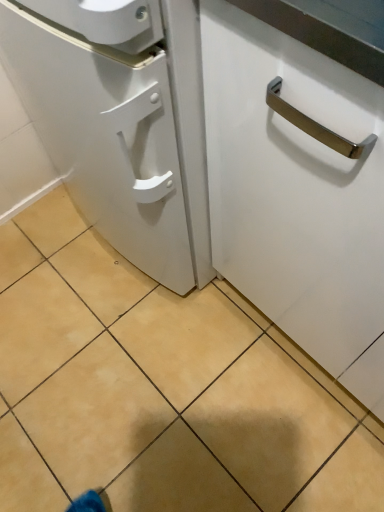
This screenshot has height=512, width=384. I want to click on white glossy cabinet handle at center, so click(297, 194).

The width and height of the screenshot is (384, 512). Describe the element at coordinates (297, 194) in the screenshot. I see `white glossy cabinet handle at center` at that location.

What do you see at coordinates (160, 389) in the screenshot? This screenshot has width=384, height=512. I see `beige tile at center` at bounding box center [160, 389].

In order to face beige tile at center, should I rotate leftwards or rightwards?

To face it directly, rotate left by 9.721 degrees.

Locate an element on the screen. The width and height of the screenshot is (384, 512). beige tile at center is located at coordinates (160, 389).

What is the approximate height of beige tile at center?

beige tile at center is 1.40 inches tall.

I want to click on white glossy cabinet handle at center, so click(297, 194).

From the picture: Considering the relative positions of white glossy cabinet handle at center and beige tile at center in the image provided, is white glossy cabinet handle at center to the left or to the right of beige tile at center?

From the image, it's evident that white glossy cabinet handle at center is to the right of beige tile at center.

Considering their positions, is white glossy cabinet handle at center located in front of or behind beige tile at center?

Visually, white glossy cabinet handle at center is located in front of beige tile at center.

Does point (340, 249) appear closer or farther from the camera than point (91, 417)?

Point (340, 249) is positioned closer to the camera compared to point (91, 417).

From the image's perspective, is white glossy cabinet handle at center positioned above or below beige tile at center?

Clearly, from the image's perspective, white glossy cabinet handle at center is above beige tile at center.

From a real-world perspective, relative to beige tile at center, is white glossy cabinet handle at center vertically above or below?

In terms of real-world spatial position, white glossy cabinet handle at center is above beige tile at center.

Considering the sizes of objects white glossy cabinet handle at center and beige tile at center in the image provided, who is thinner, white glossy cabinet handle at center or beige tile at center?

white glossy cabinet handle at center is thinner.

Considering the sizes of objects white glossy cabinet handle at center and beige tile at center in the image provided, who is taller, white glossy cabinet handle at center or beige tile at center?

white glossy cabinet handle at center is taller.

Considering the relative sizes of white glossy cabinet handle at center and beige tile at center in the image provided, is white glossy cabinet handle at center bigger than beige tile at center?

Indeed, white glossy cabinet handle at center has a larger size compared to beige tile at center.

Is white glossy cabinet handle at center spatially inside beige tile at center, or outside of it?

white glossy cabinet handle at center is not inside beige tile at center, it's outside.

Are white glossy cabinet handle at center and beige tile at center far apart?

Actually, white glossy cabinet handle at center and beige tile at center are a little close together.

Is white glossy cabinet handle at center facing towards beige tile at center?

Yes, white glossy cabinet handle at center faces towards beige tile at center.

Can you tell me how much white glossy cabinet handle at center and beige tile at center differ in facing direction?

The angle between the facing direction of white glossy cabinet handle at center and the facing direction of beige tile at center is 0.153 degrees.

Find the location of a particular element. The image size is (384, 512). tile lying behind the white glossy cabinet handle at center is located at coordinates (160, 389).

Is beige tile at center to the right of white glossy cabinet handle at center from the viewer's perspective?

Incorrect, beige tile at center is not on the right side of white glossy cabinet handle at center.

Which is behind, beige tile at center or white glossy cabinet handle at center?

beige tile at center is further away from the camera.

Between point (172, 426) and point (291, 251), which one is positioned behind?

The point (172, 426) is farther.

From the image's perspective, is beige tile at center under white glossy cabinet handle at center?

Yes, from the image's perspective, beige tile at center is beneath white glossy cabinet handle at center.

From a real-world perspective, who is located higher, beige tile at center or white glossy cabinet handle at center?

white glossy cabinet handle at center is physically above.

Can you confirm if beige tile at center is wider than white glossy cabinet handle at center?

Yes, beige tile at center is wider than white glossy cabinet handle at center.

Can you confirm if beige tile at center is taller than white glossy cabinet handle at center?

In fact, beige tile at center may be shorter than white glossy cabinet handle at center.

Who is bigger, beige tile at center or white glossy cabinet handle at center?

With larger size is white glossy cabinet handle at center.

Would you say beige tile at center is outside white glossy cabinet handle at center?

beige tile at center lies outside white glossy cabinet handle at center's area.

In the scene shown: Would you say beige tile at center is a long distance from white glossy cabinet handle at center?

No, beige tile at center is in close proximity to white glossy cabinet handle at center.

Is beige tile at center positioned with its back to white glossy cabinet handle at center?

No, beige tile at center's orientation is not away from white glossy cabinet handle at center.

How many degrees apart are the facing directions of beige tile at center and white glossy cabinet handle at center?

0.153 degrees separate the facing orientations of beige tile at center and white glossy cabinet handle at center.

You are a GUI agent. You are given a task and a screenshot of the screen. Output one action in this format:
    pyautogui.click(x=<x>, y=<y>)
    Task: Click on the tile behind the white glossy cabinet handle at center
    
    Given the screenshot: What is the action you would take?
    pyautogui.click(x=160, y=389)

This screenshot has height=512, width=384. Find the location of `tile located underneath the white glossy cabinet handle at center (from a real-world perspective)`. tile located underneath the white glossy cabinet handle at center (from a real-world perspective) is located at coordinates pyautogui.click(x=160, y=389).

Where is `cabinetry positioned vertically above the beige tile at center (from a real-world perspective)`? cabinetry positioned vertically above the beige tile at center (from a real-world perspective) is located at coordinates (297, 194).